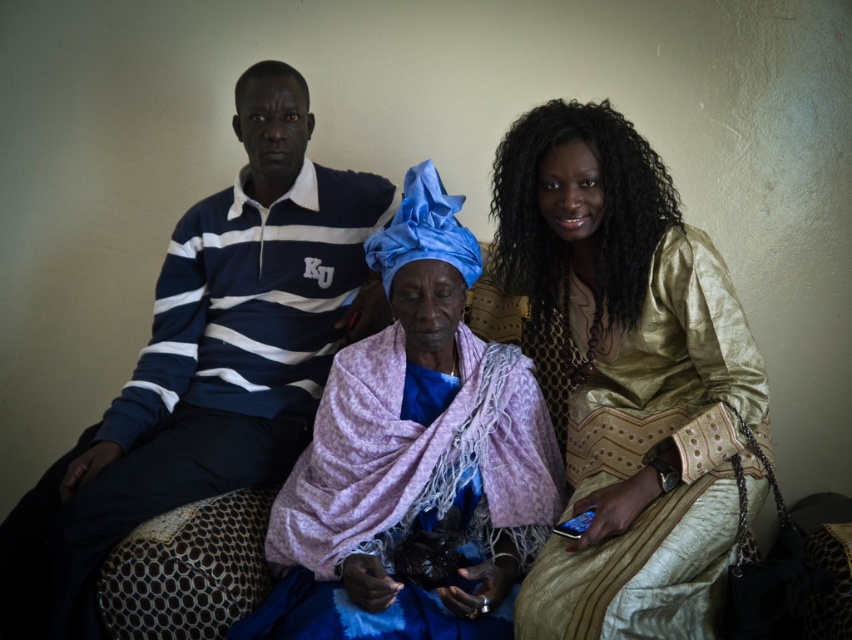
You are a photographer taking a portrait of the three people on the couch. You want to focus on the gold metallic dress at center and the purple fabric at center. Which one will appear larger in your photo?

The gold metallic dress at center is closer to the viewer than the purple fabric at center, so it will appear larger in the photo.

You are standing in front of the couch and want to place a small gift on the left side of the matte blue and white striped polo shirt at left. Where should you place it?

The small gift should be placed to the left of the matte blue and white striped polo shirt at left, which is located at point (209,360) in the image.